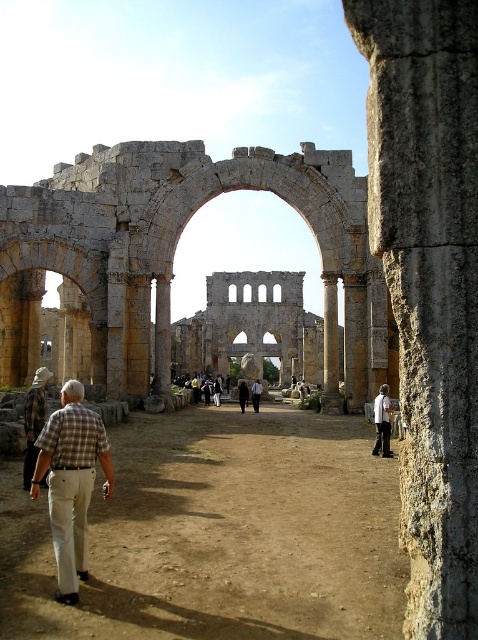
You are a photographer trying to capture a group photo of the visitors at the ancient Roman structure. You notice a person wearing a white cotton shirt at center and another dressed as a black fabric person at center. Which visitor should you focus on to ensure their full body fits in the frame if your camera has a limited width capacity?

You should focus on the black fabric person at center because the white cotton shirt at center is wider, so the narrower black fabric person at center will fit better within the camera frame.

You are a photographer planning to take a picture of the stone archway at center and the plaid shirt at lower left. Which object should you focus on first if you want to capture both in a single frame without moving the camera?

The stone archway at center is larger in size than the plaid shirt at lower left, so you should focus on the stone archway at center first to ensure it fills the frame appropriately before adjusting for the smaller plaid shirt at lower left.

You are standing at the ruins of an ancient Roman structure. You notice a white cotton shirt at center. Can you confirm if the white cotton shirt at center is located exactly at the coordinates point [381,422]?

Yes, the white cotton shirt at center is located exactly at the coordinates point [381,422] as described.